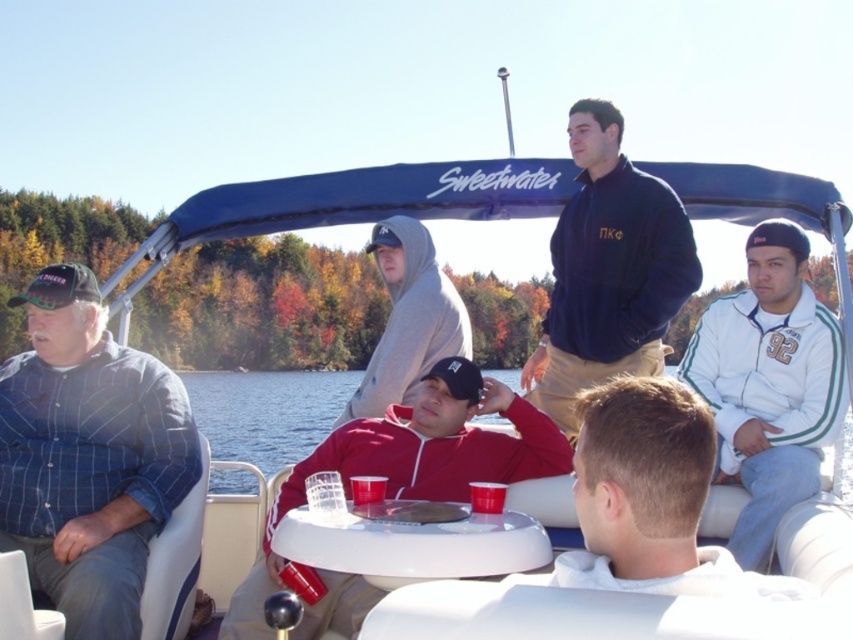
Question: Estimate the real-world distances between objects in this image. Which object is farther from the white fleece jacket at center?

Choices:
 (A) gray hoodie at center
 (B) white fleece jacket at right

Answer: (A)

Question: Does blue plaid shirt at left have a larger size compared to white fleece jacket at center?

Choices:
 (A) no
 (B) yes

Answer: (B)

Question: Is blue plaid shirt at left behind red fleece jacket at center?

Choices:
 (A) no
 (B) yes

Answer: (A)

Question: Which point appears closest to the camera in this image?

Choices:
 (A) [x=706, y=488]
 (B) [x=486, y=378]
 (C) [x=694, y=348]
 (D) [x=0, y=544]

Answer: (A)

Question: Is navy blue fleece at center bigger than red matte water at center?

Choices:
 (A) yes
 (B) no

Answer: (B)

Question: Among these points, which one is farthest from the camera?

Choices:
 (A) (263, 440)
 (B) (401, 376)
 (C) (581, 524)

Answer: (A)